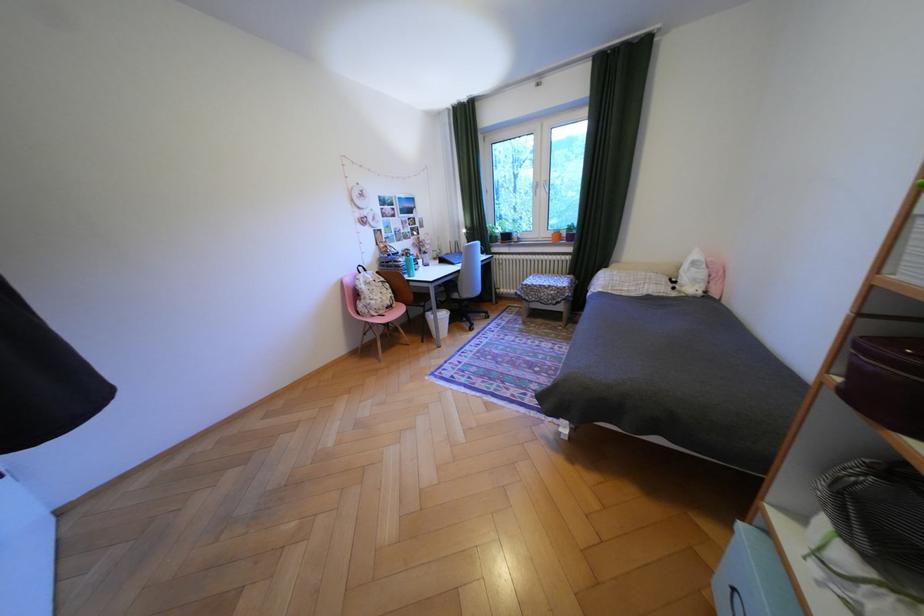
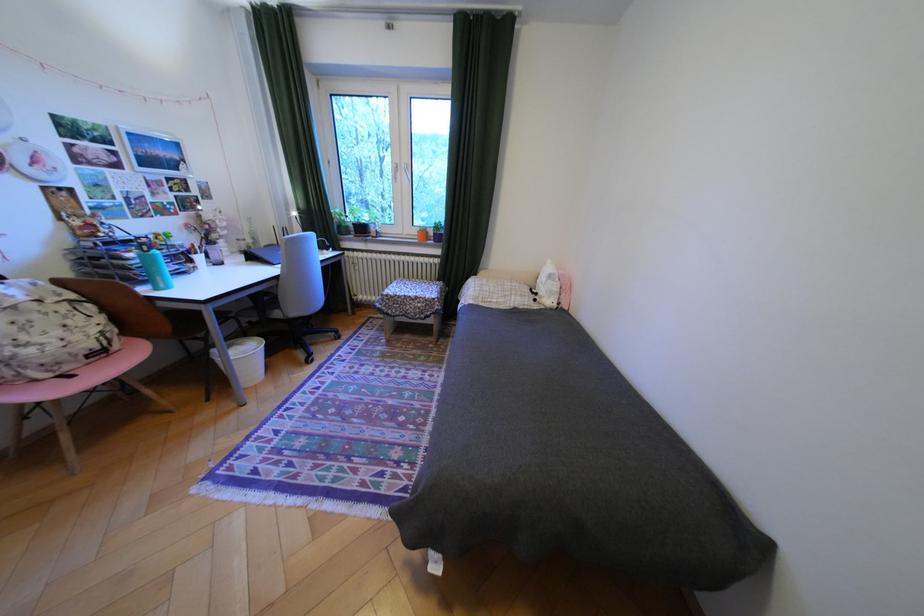
Question: I am providing you with two images of the same scene from different viewpoints. Which of the following objects are not visible in image2?

Choices:
 (A) white stuffed animal
 (B) orange flower pot
 (C) blue chair sitting surface
 (D) none of these

Answer: (D)